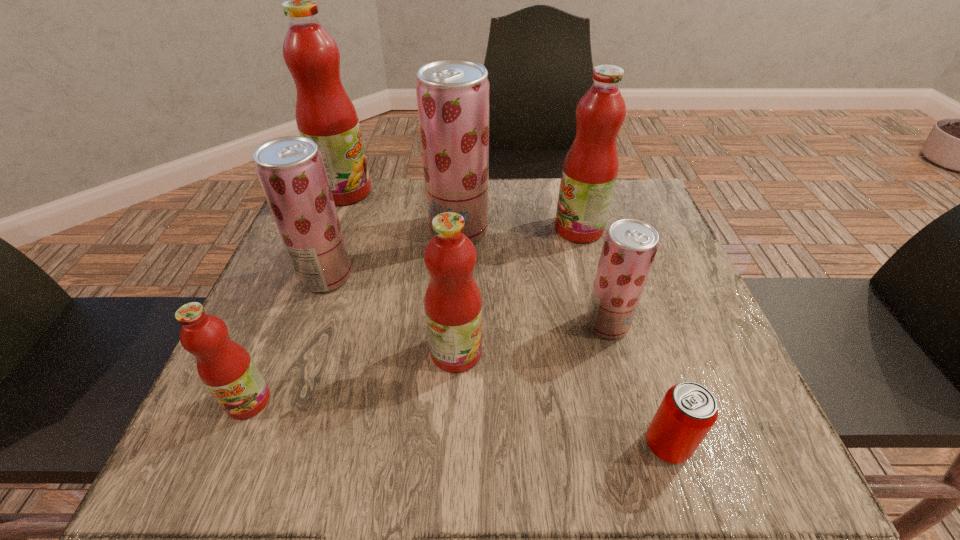
Locate an element on the screen. This screenshot has height=540, width=960. the farthest pink fruit juice is located at coordinates (324, 113).

Where is `the farthest object`? the farthest object is located at coordinates (324, 113).

Locate an element on the screen. This screenshot has width=960, height=540. the second biggest pink fruit juice is located at coordinates (590, 168).

Identify the location of the rightmost pink fruit juice. Image resolution: width=960 pixels, height=540 pixels. (590, 168).

Where is `the biggest strawberry fruit juice`? The width and height of the screenshot is (960, 540). the biggest strawberry fruit juice is located at coordinates (453, 95).

The height and width of the screenshot is (540, 960). Identify the location of the second strawberry fruit juice from right to left. (453, 95).

Where is `the second farthest strawberry fruit juice`? The image size is (960, 540). the second farthest strawberry fruit juice is located at coordinates (291, 170).

Where is `the leftmost strawberry fruit juice`? The width and height of the screenshot is (960, 540). the leftmost strawberry fruit juice is located at coordinates (291, 170).

The width and height of the screenshot is (960, 540). I want to click on the third biggest pink fruit juice, so click(453, 303).

Where is `the third pink fruit juice from left to right`? the third pink fruit juice from left to right is located at coordinates (453, 303).